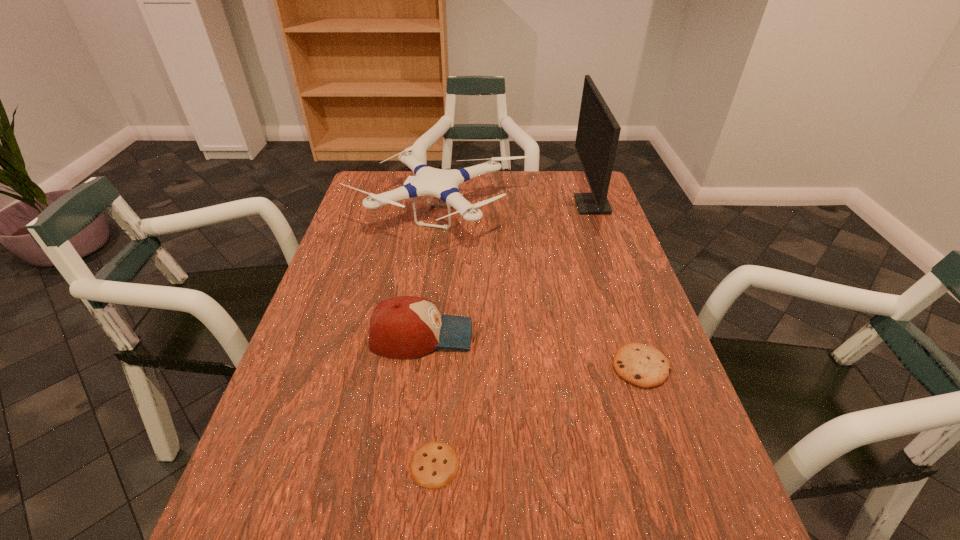
Identify the location of vacant space in between the taller cookie and the tallest object. (616, 286).

Locate an element on the screen. This screenshot has height=540, width=960. free spot between the baseball cap and the fourth shortest object is located at coordinates (431, 275).

Find the location of a particular element. This screenshot has width=960, height=540. vacant space that is in between the computer monitor and the farther cookie is located at coordinates (616, 286).

Select which object is the fourth closest to the farther cookie. Please provide its 2D coordinates. Your answer should be formatted as a tuple, i.e. [(x, y)], where the tuple contains the x and y coordinates of a point satisfying the conditions above.

[(598, 131)]

Point out which object is positioned as the fourth nearest to the baseball cap. Please provide its 2D coordinates. Your answer should be formatted as a tuple, i.e. [(x, y)], where the tuple contains the x and y coordinates of a point satisfying the conditions above.

[(598, 131)]

Where is `vacant space that satisfies the following two spatial constraints: 1. on the front-facing side of the baseball cap; 2. on the back side of the taller cookie`? The width and height of the screenshot is (960, 540). vacant space that satisfies the following two spatial constraints: 1. on the front-facing side of the baseball cap; 2. on the back side of the taller cookie is located at coordinates (418, 367).

Identify the location of free location that satisfies the following two spatial constraints: 1. on the front side of the drone; 2. on the front-facing side of the third tallest object. This screenshot has height=540, width=960. (426, 336).

Image resolution: width=960 pixels, height=540 pixels. What are the coordinates of `free location that satisfies the following two spatial constraints: 1. on the front-facing side of the third shortest object; 2. on the back side of the nearest object` in the screenshot? It's located at (405, 464).

Identify the location of vacant space that satisfies the following two spatial constraints: 1. on the front-facing side of the nearest object; 2. on the left side of the third tallest object. (405, 464).

Locate an element on the screen. The width and height of the screenshot is (960, 540). free point that satisfies the following two spatial constraints: 1. on the front-facing side of the right cookie; 2. on the left side of the third tallest object is located at coordinates (418, 367).